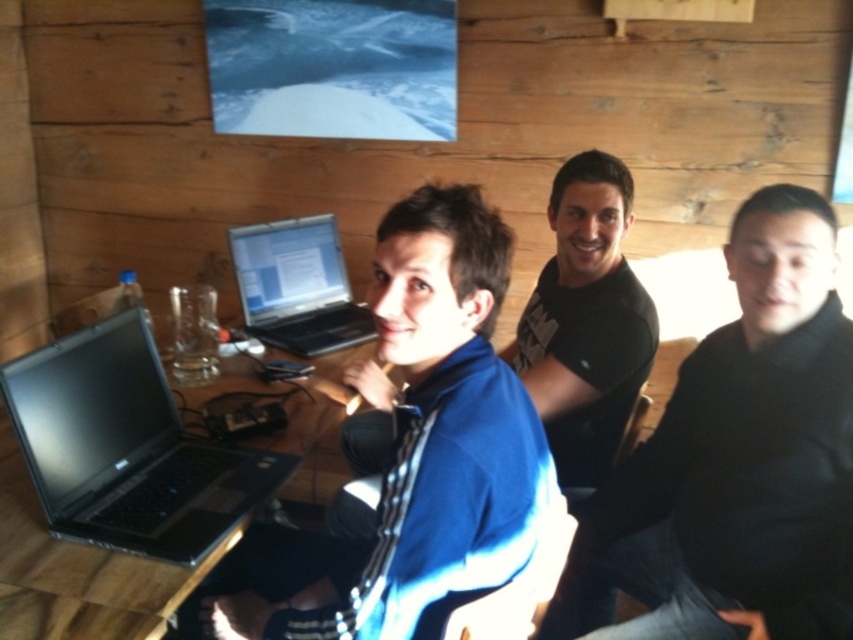
Question: Can you confirm if blue fleece jacket at center is smaller than silver metallic laptop at center?

Choices:
 (A) no
 (B) yes

Answer: (A)

Question: Based on their relative distances, which object is nearer to the black matte laptop at left?

Choices:
 (A) blue fleece jacket at center
 (B) silver metallic laptop at center

Answer: (A)

Question: In this image, where is blue fleece jacket at center located relative to silver metallic laptop at center?

Choices:
 (A) right
 (B) left

Answer: (A)

Question: Is blue fleece jacket at center wider than silver metallic laptop at center?

Choices:
 (A) no
 (B) yes

Answer: (B)

Question: Among these points, which one is nearest to the camera?

Choices:
 (A) click(761, 445)
 (B) click(314, 273)
 (C) click(427, 419)

Answer: (C)

Question: Based on their relative distances, which object is farther from the blue fleece jacket at center?

Choices:
 (A) black matte laptop at left
 (B) silver metallic laptop at center
 (C) black matte shirt at right

Answer: (B)